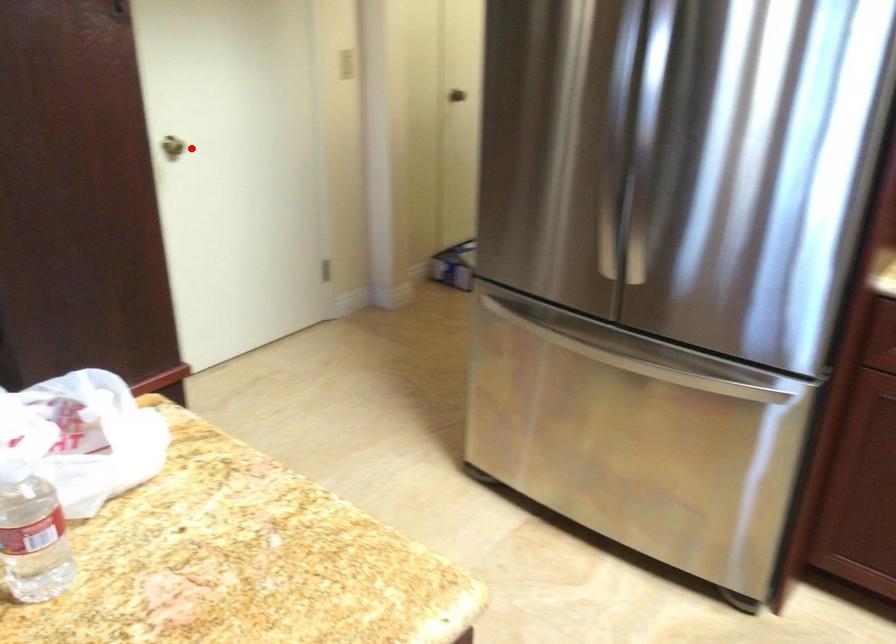
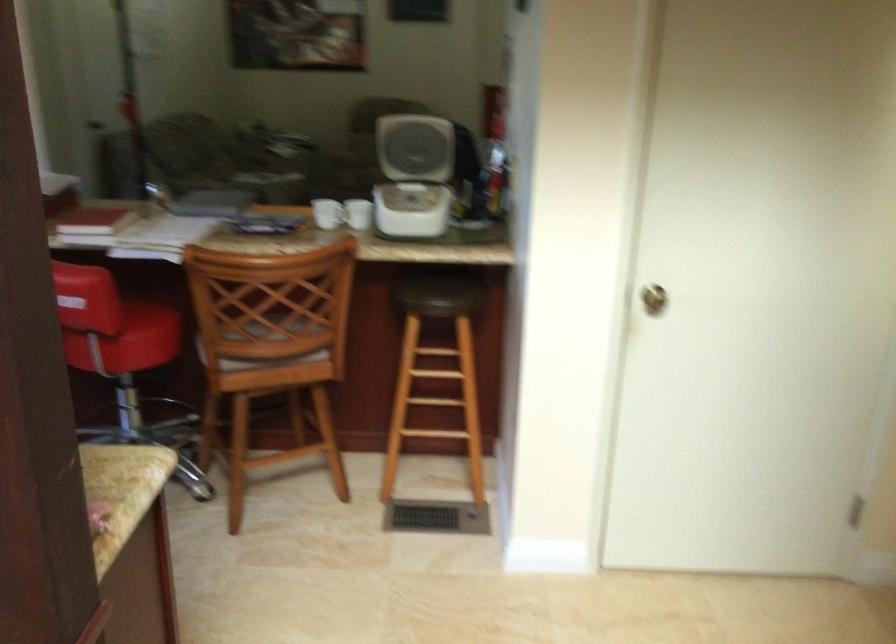
In the second image, find the point that corresponds to the highlighted location in the first image.

(653, 299)